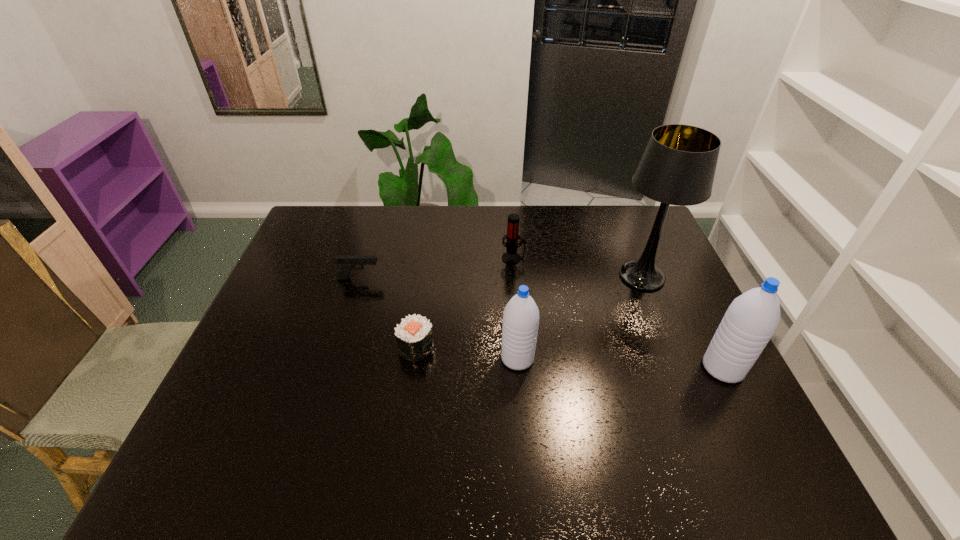
Where is `free location located 0.130m on the left of the third shortest object`? This screenshot has width=960, height=540. free location located 0.130m on the left of the third shortest object is located at coordinates [462, 258].

This screenshot has width=960, height=540. I want to click on blank area located 0.190m on the front-facing side of the leftmost object, so click(442, 278).

At what (x,y) coordinates should I click in order to perform the action: click on vacant space located 0.150m on the left of the tallest object. Please return your answer as a coordinate pair (x, y). The image size is (960, 540). Looking at the image, I should click on (563, 276).

Where is `free space located on the right of the sushi`? Image resolution: width=960 pixels, height=540 pixels. free space located on the right of the sushi is located at coordinates (494, 348).

Where is `water bottle located in the right edge section of the desktop`? The width and height of the screenshot is (960, 540). water bottle located in the right edge section of the desktop is located at coordinates (750, 321).

At what (x,y) coordinates should I click in order to perform the action: click on table lamp that is positioned at the right edge. Please return your answer as a coordinate pair (x, y). Image resolution: width=960 pixels, height=540 pixels. Looking at the image, I should click on (678, 166).

Locate an element on the screen. The width and height of the screenshot is (960, 540). blank area at the far edge is located at coordinates (385, 225).

Find the location of a particular element. This screenshot has height=540, width=960. free space at the left edge of the desktop is located at coordinates (291, 280).

In the image, there is a desktop. Where is `free region at the right edge`? free region at the right edge is located at coordinates (657, 294).

This screenshot has height=540, width=960. In the image, there is a desktop. Find the location of `free space at the far left corner`. free space at the far left corner is located at coordinates (335, 224).